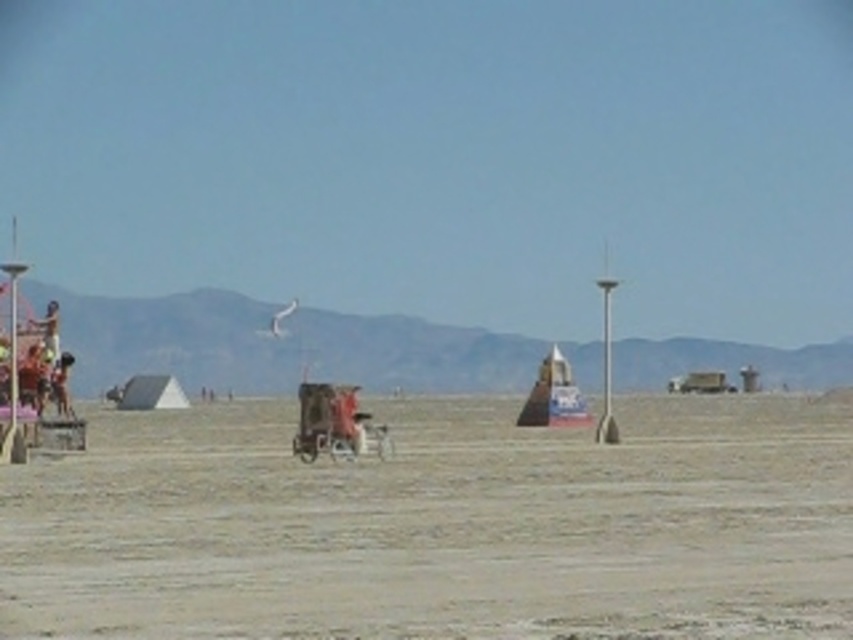
Question: Which object is farther from the camera taking this photo?

Choices:
 (A) gray sand at center
 (B) metallic silver baby carriage at center

Answer: (B)

Question: Is gray sand at center below metallic silver baby carriage at center?

Choices:
 (A) yes
 (B) no

Answer: (A)

Question: Observing the image, what is the correct spatial positioning of gray sand at center in reference to metallic silver baby carriage at center?

Choices:
 (A) right
 (B) left

Answer: (A)

Question: Which point is farther to the camera?

Choices:
 (A) (25, 499)
 (B) (347, 385)

Answer: (B)

Question: Is gray sand at center thinner than metallic silver baby carriage at center?

Choices:
 (A) yes
 (B) no

Answer: (B)